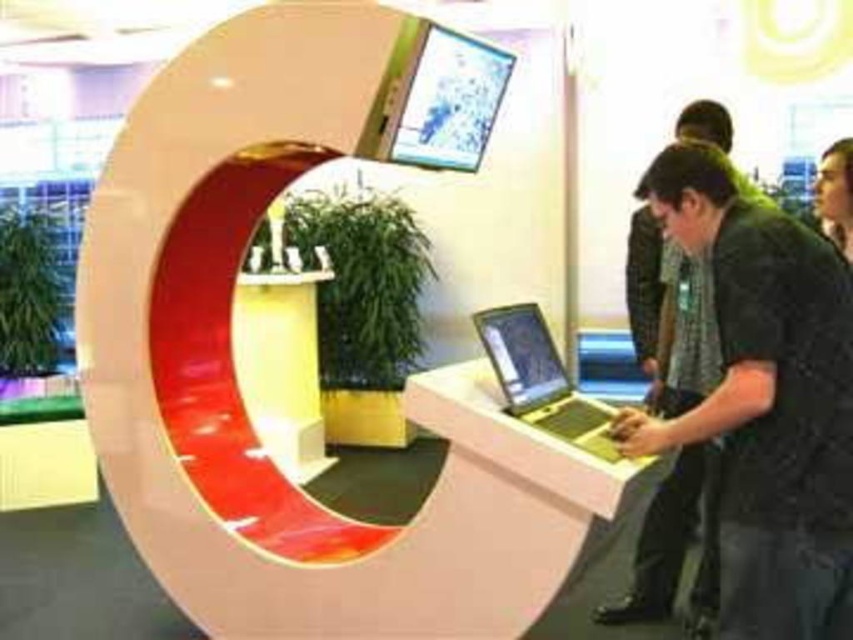
You are a photographer at the tech event and need to capture a closeup of the laptop on the counter. The black textured shirt at center is blocking your view. Where should you move to get an unobstructed view of the laptop?

The black textured shirt at center is positioned at point [764,401], so you should move to the left or right of the shirt to get an unobstructed view of the laptop.

Consider the image. You are a visitor at the tech event and need to place your silver metallic laptop at center on the white plastic information desk at center. Can the laptop fit on the desk based on their sizes?

The white plastic information desk at center has a greater height compared to silver metallic laptop at center, so yes, the laptop can fit on the desk since the desk is taller than the laptop.